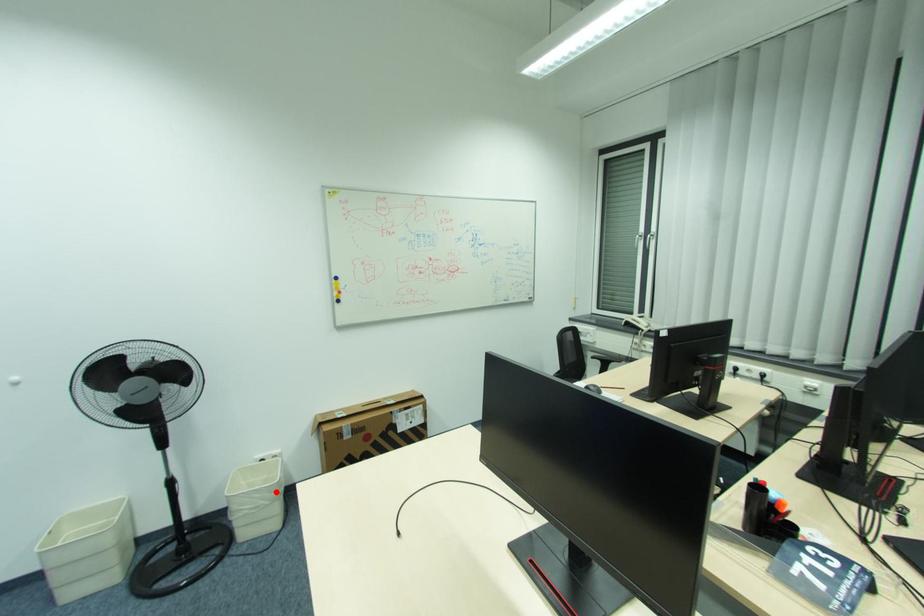
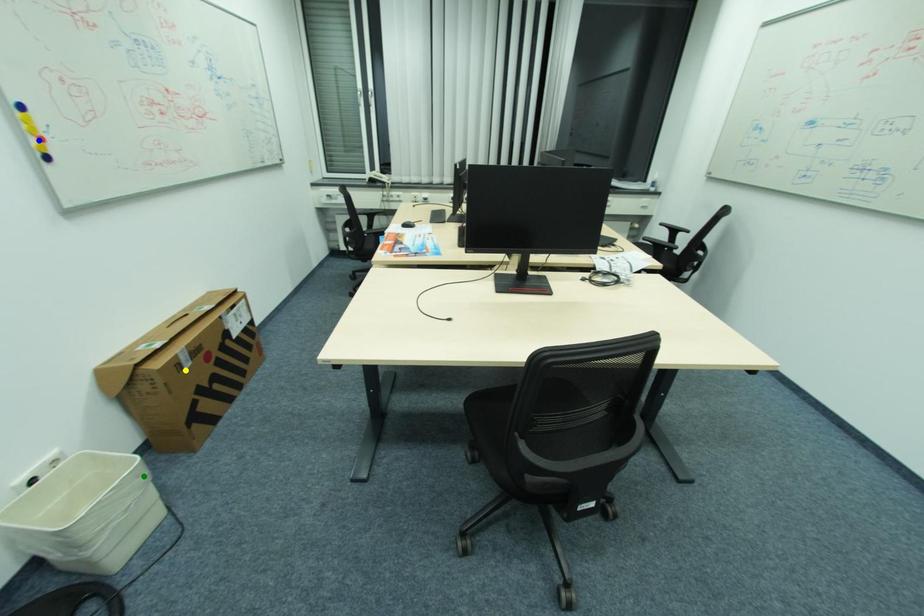
Question: I am providing you with two images of the same scene from different viewpoints. A red point is marked on the first image. You are given multiple points on the second image. Which point in image 2 represents the same 3d spot as the red point in image 1?

Choices:
 (A) green point
 (B) blue point
 (C) yellow point

Answer: (A)